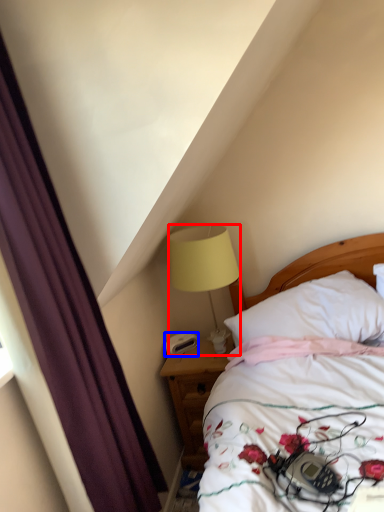
Question: Which point is closer to the camera, lamp (highlighted by a red box) or alarm clock (highlighted by a blue box)?

Choices:
 (A) lamp
 (B) alarm clock

Answer: (A)